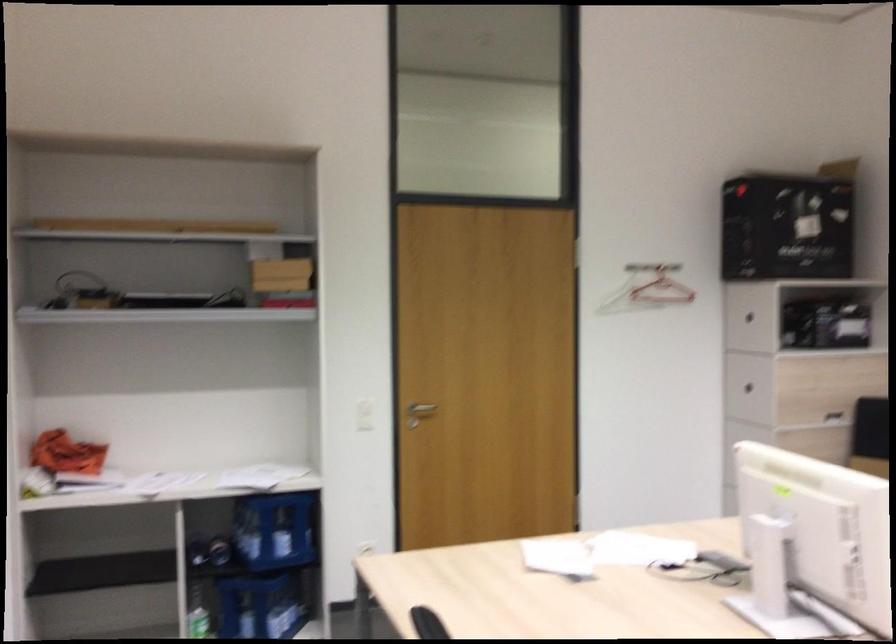
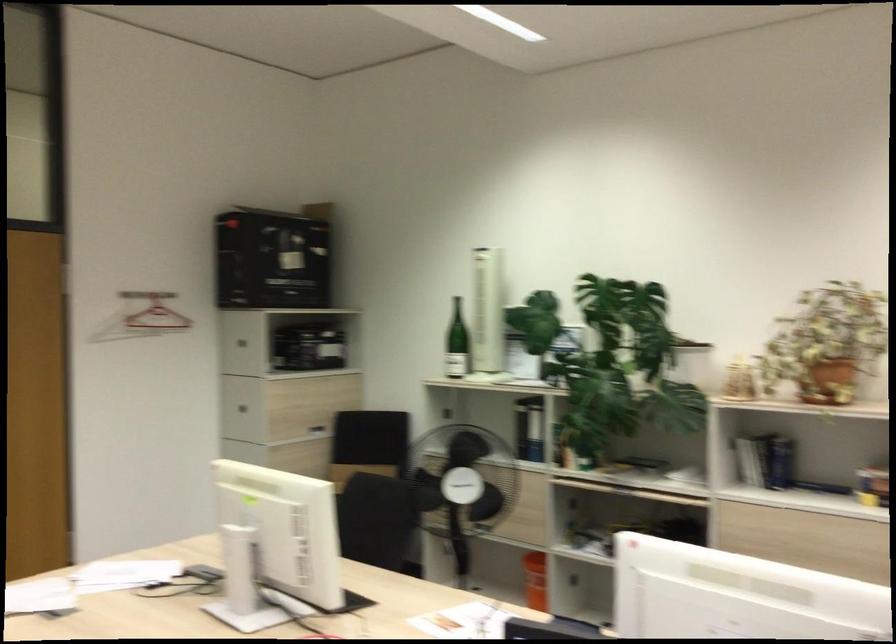
Find the pixel in the second image that matches (746,319) in the first image.

(237, 341)